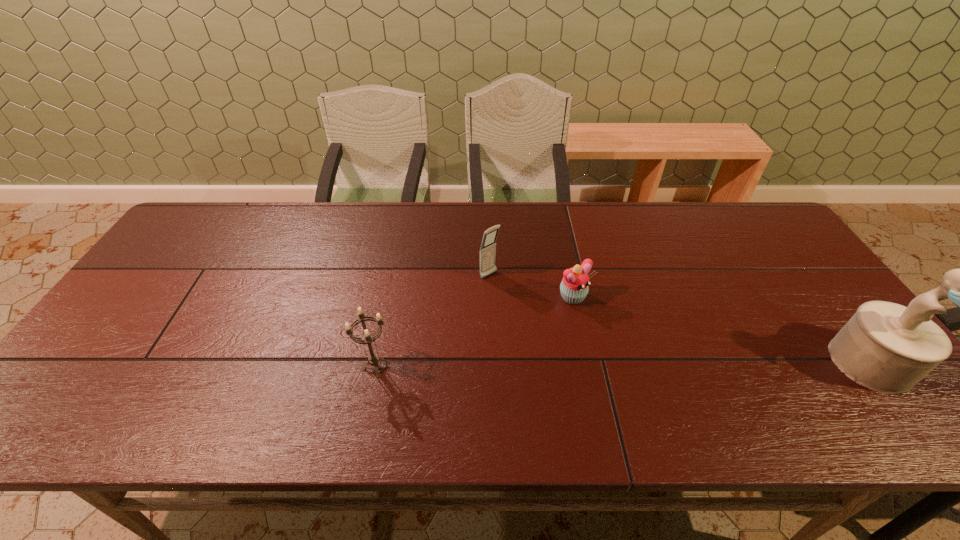
Locate an element on the screen. vacant space located 0.240m on the face of the cupcake is located at coordinates (657, 373).

Find the location of `vacant space located 0.090m on the front-facing side of the farthest object`. vacant space located 0.090m on the front-facing side of the farthest object is located at coordinates (516, 298).

I want to click on free location located on the front-facing side of the farthest object, so click(525, 307).

Where is `vacant space situated on the front-facing side of the farthest object`? The width and height of the screenshot is (960, 540). vacant space situated on the front-facing side of the farthest object is located at coordinates (533, 314).

Identify the location of candle holder situated at the near edge. (373, 359).

Where is `figurine located at the near edge`? The width and height of the screenshot is (960, 540). figurine located at the near edge is located at coordinates (886, 347).

What are the coordinates of `object that is at the right edge` in the screenshot? It's located at (886, 347).

Where is `object that is at the near right corner`? The image size is (960, 540). object that is at the near right corner is located at coordinates (886, 347).

This screenshot has width=960, height=540. In the image, there is a desktop. Identify the location of blank space at the far edge. (520, 237).

In the image, there is a desktop. Where is `free space at the near edge`? This screenshot has height=540, width=960. free space at the near edge is located at coordinates (601, 367).